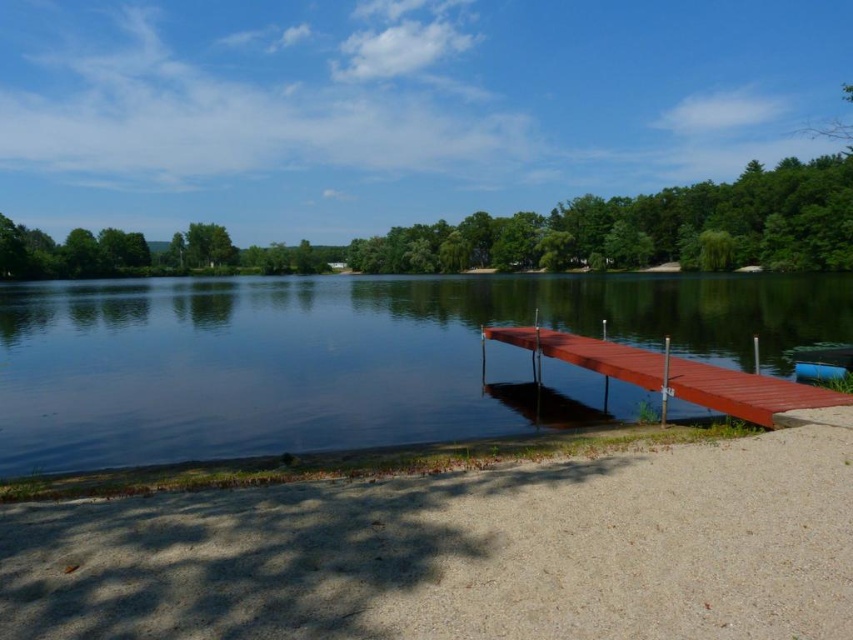
Question: Is smooth water at center thinner than blue plastic boat at lower right?

Choices:
 (A) no
 (B) yes

Answer: (A)

Question: Observing the image, what is the correct spatial positioning of smooth water at center in reference to smooth wood dock at lower right?

Choices:
 (A) left
 (B) right

Answer: (A)

Question: Among these objects, which one is nearest to the camera?

Choices:
 (A) smooth water at center
 (B) smooth wood dock at lower right

Answer: (B)

Question: Which object appears closest to the camera in this image?

Choices:
 (A) smooth water at center
 (B) blue plastic boat at lower right

Answer: (A)

Question: Which of the following is the farthest from the observer?

Choices:
 (A) smooth wood dock at lower right
 (B) smooth water at center

Answer: (B)

Question: Where is smooth water at center located in relation to blue plastic boat at lower right in the image?

Choices:
 (A) left
 (B) right

Answer: (A)